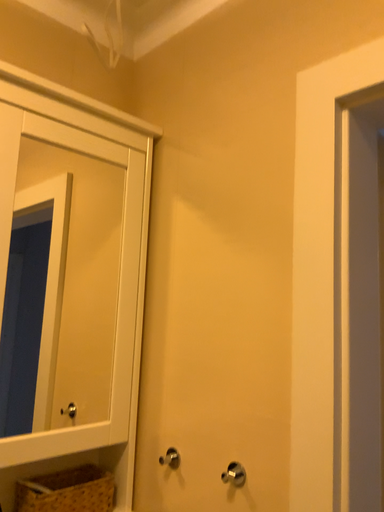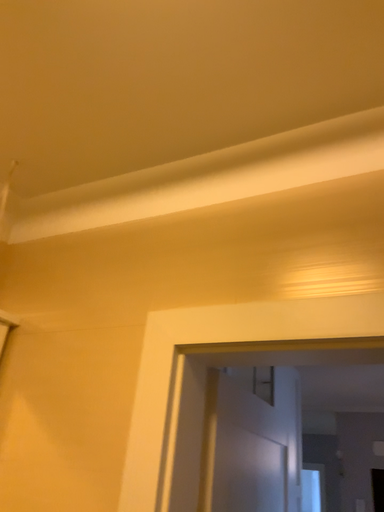
Question: Which way did the camera rotate in the video?

Choices:
 (A) rotated downward
 (B) rotated upward

Answer: (B)